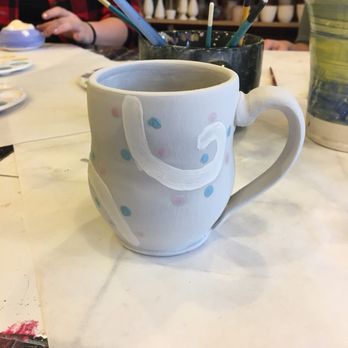
I want to click on white table cloth, so click(x=49, y=87), click(x=163, y=290), click(x=270, y=139).